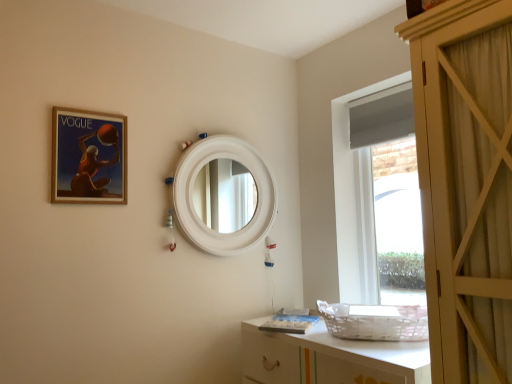
Question: From a real-world perspective, is white glossy cabinet at lower right positioned under matte wooden picture frame at upper left based on gravity?

Choices:
 (A) yes
 (B) no

Answer: (A)

Question: Is matte wooden picture frame at upper left inside white glossy cabinet at lower right?

Choices:
 (A) yes
 (B) no

Answer: (B)

Question: Considering the relative sizes of white glossy cabinet at lower right and matte wooden picture frame at upper left in the image provided, is white glossy cabinet at lower right shorter than matte wooden picture frame at upper left?

Choices:
 (A) no
 (B) yes

Answer: (B)

Question: Is white glossy cabinet at lower right turned away from matte wooden picture frame at upper left?

Choices:
 (A) yes
 (B) no

Answer: (B)

Question: Does white glossy cabinet at lower right turn towards matte wooden picture frame at upper left?

Choices:
 (A) no
 (B) yes

Answer: (A)

Question: Is white matte mirror at center in front of or behind matte wooden picture frame at upper left in the image?

Choices:
 (A) behind
 (B) front

Answer: (A)

Question: In the image, is white matte mirror at center on the left side or the right side of matte wooden picture frame at upper left?

Choices:
 (A) right
 (B) left

Answer: (A)

Question: Does point (248, 244) appear closer or farther from the camera than point (66, 152)?

Choices:
 (A) farther
 (B) closer

Answer: (A)

Question: In terms of height, does white matte mirror at center look taller or shorter compared to matte wooden picture frame at upper left?

Choices:
 (A) short
 (B) tall

Answer: (B)

Question: From a real-world perspective, is matte wooden picture frame at upper left positioned above or below white glossy cabinet at lower right?

Choices:
 (A) above
 (B) below

Answer: (A)

Question: Looking at their shapes, would you say matte wooden picture frame at upper left is wider or thinner than white glossy cabinet at lower right?

Choices:
 (A) wide
 (B) thin

Answer: (B)

Question: Is matte wooden picture frame at upper left to the left or to the right of white glossy cabinet at lower right in the image?

Choices:
 (A) right
 (B) left

Answer: (B)

Question: Considering the positions of matte wooden picture frame at upper left and white glossy cabinet at lower right in the image, is matte wooden picture frame at upper left taller or shorter than white glossy cabinet at lower right?

Choices:
 (A) tall
 (B) short

Answer: (A)

Question: Is matte wooden picture frame at upper left wider or thinner than white matte mirror at center?

Choices:
 (A) thin
 (B) wide

Answer: (A)

Question: Is point (57, 177) closer or farther from the camera than point (267, 198)?

Choices:
 (A) farther
 (B) closer

Answer: (B)